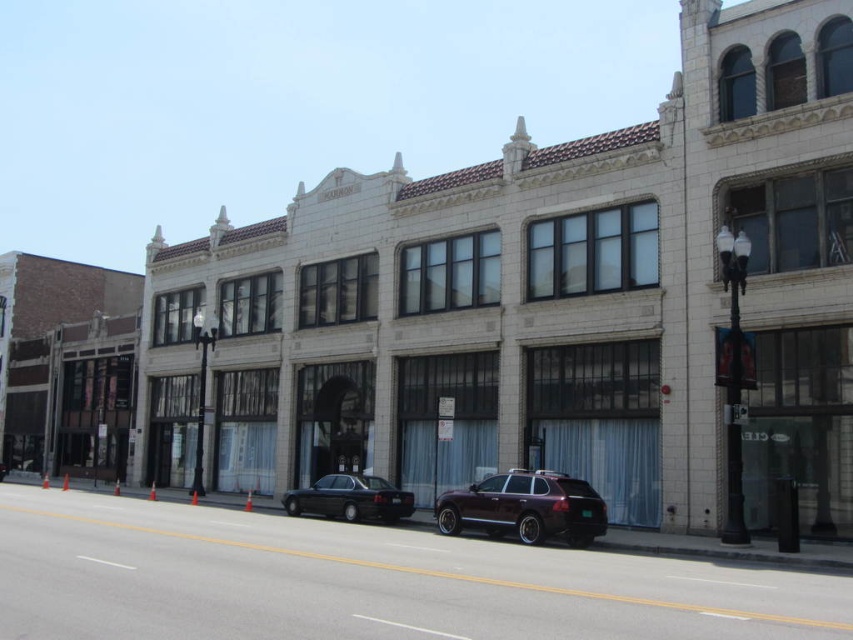
Consider the image. You are standing on the street looking at the buildings. There is a point marked at coordinates (525, 508). What object is located at that point?

The point at coordinates (525, 508) marks the location of the satin burgundy suv at center.

From the picture: You are a delivery driver who needs to park your 3.5 meter long truck between the satin burgundy suv at center and the shiny black sedan at center. Is there enough space between them to park your truck?

The satin burgundy suv at center and shiny black sedan at center are 5.56 meters apart. Since your truck is 3.5 meters long, there is sufficient space between them to park your truck as 5.56 meters is greater than 3.5 meters.

You are a pedestrian standing on the sidewalk and see the satin burgundy suv at center and the shiny black sedan at center. Which vehicle is positioned more to the right side of the street?

The satin burgundy suv at center is positioned more to the right side of the street because it is to the right of the shiny black sedan at center.